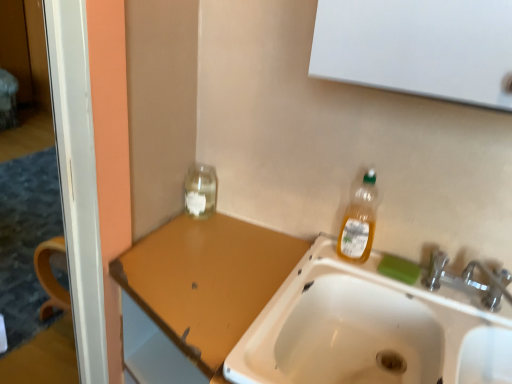
You are a GUI agent. You are given a task and a screenshot of the screen. Output one action in this format:
    pyautogui.click(x=<x>, y=<y>)
    Task: Click on the translucent plastic bottle at upper right
    The image size is (512, 384).
    Given the screenshot: What is the action you would take?
    pyautogui.click(x=359, y=222)

This screenshot has width=512, height=384. What do you see at coordinates (200, 190) in the screenshot?
I see `transparent glass jar at upper left` at bounding box center [200, 190].

The width and height of the screenshot is (512, 384). Describe the element at coordinates (197, 293) in the screenshot. I see `brown matte counter top at upper left` at that location.

In order to face brown matte counter top at upper left, should I rotate leftwards or rightwards?

You should rotate left by 8.587 degrees.

Locate an element on the screen. Image resolution: width=512 pixels, height=384 pixels. translucent plastic bottle at upper right is located at coordinates (359, 222).

From a real-world perspective, is white ceramic sink at lower center on top of brown matte counter top at upper left?

Yes, from a real-world perspective, white ceramic sink at lower center is above brown matte counter top at upper left.

Is white ceramic sink at lower center oriented towards brown matte counter top at upper left?

No, white ceramic sink at lower center is not aimed at brown matte counter top at upper left.

Considering the relative sizes of white ceramic sink at lower center and brown matte counter top at upper left in the image provided, is white ceramic sink at lower center taller than brown matte counter top at upper left?

Incorrect, the height of white ceramic sink at lower center is not larger of that of brown matte counter top at upper left.

Which object is closer to the camera, brown matte counter top at upper left or white ceramic sink at lower center?

white ceramic sink at lower center is more forward.

Considering the relative positions of brown matte counter top at upper left and white ceramic sink at lower center in the image provided, is brown matte counter top at upper left to the left or to the right of white ceramic sink at lower center?

In the image, brown matte counter top at upper left appears on the left side of white ceramic sink at lower center.

Is brown matte counter top at upper left oriented towards white ceramic sink at lower center?

No, brown matte counter top at upper left is not aimed at white ceramic sink at lower center.

How different are the orientations of brown matte counter top at upper left and white ceramic sink at lower center in degrees?

0.779 degrees separate the facing orientations of brown matte counter top at upper left and white ceramic sink at lower center.

From the picture: Between translucent plastic bottle at upper right and brown matte counter top at upper left, which one appears on the left side from the viewer's perspective?

brown matte counter top at upper left.

You are a GUI agent. You are given a task and a screenshot of the screen. Output one action in this format:
    pyautogui.click(x=<x>, y=<y>)
    Task: Click on the bottle above the brown matte counter top at upper left (from a real-world perspective)
    
    Given the screenshot: What is the action you would take?
    pyautogui.click(x=359, y=222)

Between translucent plastic bottle at upper right and brown matte counter top at upper left, which one has larger size?

With larger size is brown matte counter top at upper left.

From a real-world perspective, is translucent plastic bottle at upper right under brown matte counter top at upper left?

Incorrect, from a real-world perspective, translucent plastic bottle at upper right is higher than brown matte counter top at upper left.

Between green matte bar of soap at sink right and translucent plastic bottle at upper right, which one is positioned in front?

translucent plastic bottle at upper right is more forward.

Which point is more distant from viewer, (415, 268) or (370, 191)?

The point (415, 268) is farther from the camera.

From a real-world perspective, which object rests below the other?

In real-world perspective, green matte bar of soap at sink right is lower.

The width and height of the screenshot is (512, 384). In order to click on soap below the translucent plastic bottle at upper right (from the image's perspective) in this screenshot , I will do `click(399, 269)`.

How many degrees apart are the facing directions of green matte bar of soap at sink right and white ceramic sink at lower center?

The angular difference between green matte bar of soap at sink right and white ceramic sink at lower center is 1.22 degrees.

In the scene shown: Measure the distance from green matte bar of soap at sink right to white ceramic sink at lower center.

green matte bar of soap at sink right and white ceramic sink at lower center are 20.47 centimeters apart.

Can you confirm if green matte bar of soap at sink right is positioned to the right of white ceramic sink at lower center?

Yes, green matte bar of soap at sink right is to the right of white ceramic sink at lower center.

Can you confirm if green matte bar of soap at sink right is bigger than white ceramic sink at lower center?

No, green matte bar of soap at sink right is not bigger than white ceramic sink at lower center.

Is green matte bar of soap at sink right in front of or behind transparent glass jar at upper left in the image?

green matte bar of soap at sink right is in front of transparent glass jar at upper left.

Is green matte bar of soap at sink right oriented away from transparent glass jar at upper left?

green matte bar of soap at sink right is not turned away from transparent glass jar at upper left.

Does point (412, 277) lie in front of point (201, 173)?

Yes, point (412, 277) is closer to viewer.

Considering the relative sizes of green matte bar of soap at sink right and transparent glass jar at upper left in the image provided, is green matte bar of soap at sink right taller than transparent glass jar at upper left?

No, green matte bar of soap at sink right is not taller than transparent glass jar at upper left.

Is brown matte counter top at upper left facing towards green matte bar of soap at sink right?

No, brown matte counter top at upper left is not aimed at green matte bar of soap at sink right.

Considering the positions of points (128, 292) and (388, 266), is point (128, 292) farther from camera compared to point (388, 266)?

No, it is not.

From the image's perspective, between brown matte counter top at upper left and green matte bar of soap at sink right, which one is located above?

From the image's view, green matte bar of soap at sink right is above.

From a real-world perspective, does brown matte counter top at upper left sit lower than green matte bar of soap at sink right?

Indeed, from a real-world perspective, brown matte counter top at upper left is positioned beneath green matte bar of soap at sink right.

Identify the location of sink that is on the right side of brown matte counter top at upper left. (370, 329).

Locate an element on the screen. Image resolution: width=512 pixels, height=384 pixels. counter top below the white ceramic sink at lower center (from a real-world perspective) is located at coordinates (197, 293).

Based on the photo, looking at the image, which one is located closer to green matte bar of soap at sink right, translucent plastic bottle at upper right or white ceramic sink at lower center?

translucent plastic bottle at upper right is closer to green matte bar of soap at sink right.

Based on their spatial positions, is brown matte counter top at upper left or translucent plastic bottle at upper right further from white ceramic sink at lower center?

The object further to white ceramic sink at lower center is brown matte counter top at upper left.

Considering their positions, is transparent glass jar at upper left positioned further to brown matte counter top at upper left than translucent plastic bottle at upper right?

translucent plastic bottle at upper right is positioned further to the anchor brown matte counter top at upper left.

Based on their spatial positions, is white ceramic sink at lower center or transparent glass jar at upper left further from brown matte counter top at upper left?

Based on the image, transparent glass jar at upper left appears to be further to brown matte counter top at upper left.

Which object lies nearer to the anchor point green matte bar of soap at sink right, brown matte counter top at upper left or transparent glass jar at upper left?

brown matte counter top at upper left.

Based on their spatial positions, is translucent plastic bottle at upper right or green matte bar of soap at sink right further from transparent glass jar at upper left?

green matte bar of soap at sink right lies further to transparent glass jar at upper left than the other object.

From the image, which object appears to be farther from translucent plastic bottle at upper right, transparent glass jar at upper left or brown matte counter top at upper left?

transparent glass jar at upper left.

Based on their spatial positions, is transparent glass jar at upper left or green matte bar of soap at sink right further from brown matte counter top at upper left?

green matte bar of soap at sink right is further to brown matte counter top at upper left.

Where is `counter top between white ceramic sink at lower center and transparent glass jar at upper left from front to back`? The height and width of the screenshot is (384, 512). counter top between white ceramic sink at lower center and transparent glass jar at upper left from front to back is located at coordinates (197, 293).

This screenshot has width=512, height=384. What are the coordinates of `bottle between white ceramic sink at lower center and transparent glass jar at upper left in the front-back direction` in the screenshot? It's located at click(x=359, y=222).

This screenshot has width=512, height=384. In order to click on bottle between brown matte counter top at upper left and green matte bar of soap at sink right in the horizontal direction in this screenshot , I will do `click(359, 222)`.

Locate an element on the screen. This screenshot has width=512, height=384. bottle between transparent glass jar at upper left and brown matte counter top at upper left in the up-down direction is located at coordinates (359, 222).